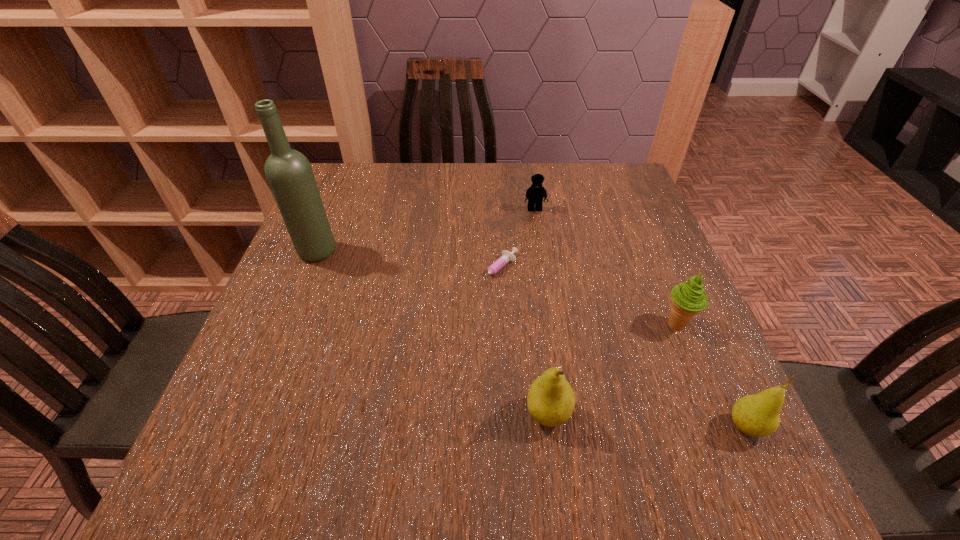
Identify the location of vacant space located on the front-facing side of the farthest object. The height and width of the screenshot is (540, 960). (543, 268).

At what (x,y) coordinates should I click in order to perform the action: click on free point located on the front of the leftmost object. Please return your answer as a coordinate pair (x, y). The width and height of the screenshot is (960, 540). Looking at the image, I should click on (293, 309).

Where is `vacant space situated 0.320m on the back of the fourth farthest object`? Image resolution: width=960 pixels, height=540 pixels. vacant space situated 0.320m on the back of the fourth farthest object is located at coordinates (634, 219).

Find the location of a particular element. The height and width of the screenshot is (540, 960). vacant space situated 0.140m on the left of the shortest object is located at coordinates (413, 271).

At what (x,y) coordinates should I click in order to perform the action: click on object at the far edge. Please return your answer as a coordinate pair (x, y). The width and height of the screenshot is (960, 540). Looking at the image, I should click on (535, 193).

I want to click on object located in the left edge section of the desktop, so click(289, 173).

What are the coordinates of `pear positioned at the right edge` in the screenshot? It's located at (757, 415).

Where is `icecream that is positioned at the right edge`? Image resolution: width=960 pixels, height=540 pixels. icecream that is positioned at the right edge is located at coordinates (688, 298).

At what (x,y) coordinates should I click in order to perform the action: click on object that is at the near right corner. Please return your answer as a coordinate pair (x, y). The width and height of the screenshot is (960, 540). Looking at the image, I should click on (757, 415).

This screenshot has height=540, width=960. I want to click on vacant space at the far edge, so click(x=499, y=173).